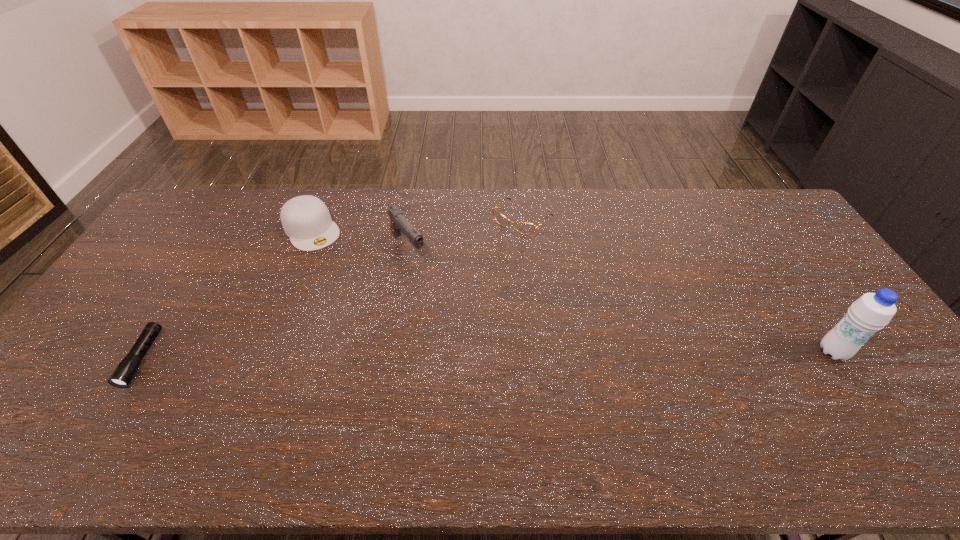
This screenshot has height=540, width=960. Find the location of `vacant space located on the left of the rightmost object`. vacant space located on the left of the rightmost object is located at coordinates (683, 352).

The width and height of the screenshot is (960, 540). I want to click on vacant position located 0.270m on the front-facing side of the fourth tallest object, so click(x=461, y=283).

At what (x,y) coordinates should I click in order to perform the action: click on vacant area situated on the front-facing side of the fourth tallest object. Please return your answer as a coordinate pair (x, y). The image size is (960, 540). Looking at the image, I should click on (465, 279).

Find the location of a particular element. vacant space located 0.100m on the front-facing side of the fourth tallest object is located at coordinates (491, 251).

Locate an element on the screen. Image resolution: width=960 pixels, height=540 pixels. vacant space located 0.180m in the direction the third object from right to left is aimed is located at coordinates (446, 299).

Find the location of `vacant space located 0.290m in the direction the third object from right to left is aimed`. vacant space located 0.290m in the direction the third object from right to left is aimed is located at coordinates (467, 323).

Find the location of a particular element. Image resolution: width=960 pixels, height=540 pixels. vacant space located 0.070m in the direction the third object from right to left is aimed is located at coordinates (428, 277).

In order to click on vacant point located on the front-facing side of the cap in this screenshot , I will do `click(341, 273)`.

The height and width of the screenshot is (540, 960). What are the coordinates of `free space located on the front-facing side of the cap` in the screenshot? It's located at (330, 259).

Identify the location of vacant space located 0.210m on the front-facing side of the cap. tap(348, 285).